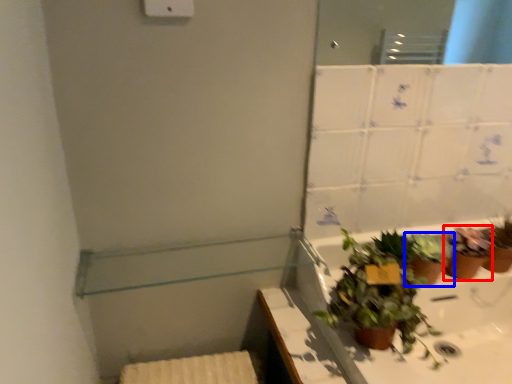
Question: Among these objects, which one is nearest to the camera, houseplant (highlighted by a red box) or houseplant (highlighted by a blue box)?

Choices:
 (A) houseplant
 (B) houseplant

Answer: (B)